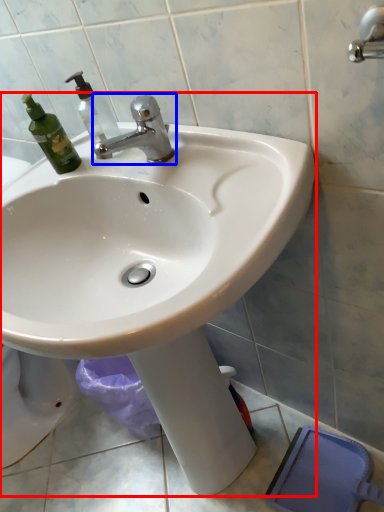
Question: Which object appears closest to the camera in this image, sink (highlighted by a red box) or tap (highlighted by a blue box)?

Choices:
 (A) sink
 (B) tap

Answer: (A)